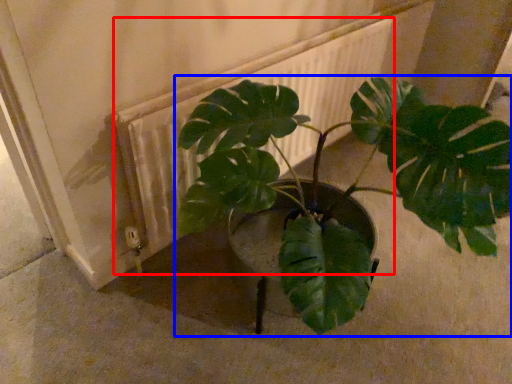
Question: Which point is closer to the camera, radiator (highlighted by a red box) or houseplant (highlighted by a blue box)?

Choices:
 (A) radiator
 (B) houseplant

Answer: (B)